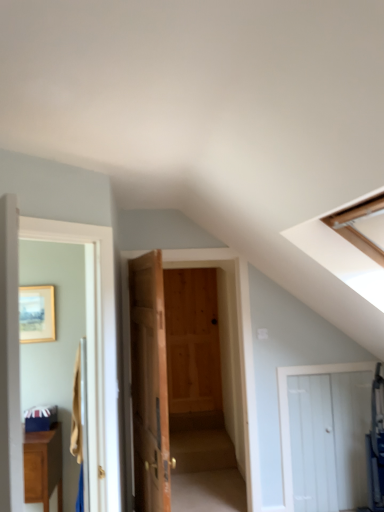
Question: Can you confirm if wooden door at center, acting as the second door starting from the left, is bigger than white wooden door at lower right, acting as the 1th door starting from the right?

Choices:
 (A) no
 (B) yes

Answer: (B)

Question: Considering the relative positions of wooden door at center, acting as the second door starting from the left, and white wooden door at lower right, the 4th door in the left-to-right sequence, in the image provided, is wooden door at center, acting as the second door starting from the left, to the left of white wooden door at lower right, the 4th door in the left-to-right sequence, from the viewer's perspective?

Choices:
 (A) yes
 (B) no

Answer: (A)

Question: Is wooden door at center, acting as the second door starting from the left, smaller than white wooden door at lower right, acting as the 1th door starting from the right?

Choices:
 (A) yes
 (B) no

Answer: (B)

Question: Does wooden door at center, which is the 3th door from right to left, lie in front of white wooden door at lower right, acting as the 1th door starting from the right?

Choices:
 (A) no
 (B) yes

Answer: (B)

Question: Is wooden door at center, acting as the second door starting from the left, shorter than white wooden door at lower right, acting as the 1th door starting from the right?

Choices:
 (A) no
 (B) yes

Answer: (A)

Question: Is wooden door at center, acting as the second door starting from the left, positioned behind white wooden door at lower right, acting as the 1th door starting from the right?

Choices:
 (A) no
 (B) yes

Answer: (A)

Question: From the image's perspective, is white wooden door at left, which appears as the 1th door when viewed from the left, over natural wood door at center, arranged as the 3th door when viewed from the left?

Choices:
 (A) no
 (B) yes

Answer: (B)

Question: From the image's perspective, is white wooden door at left, the 4th door positioned from the right, under natural wood door at center, which is the 2th door in right-to-left order?

Choices:
 (A) yes
 (B) no

Answer: (B)

Question: Does white wooden door at left, the 4th door positioned from the right, appear on the left side of natural wood door at center, which is the 2th door in right-to-left order?

Choices:
 (A) no
 (B) yes

Answer: (B)

Question: Is white wooden door at left, the 4th door positioned from the right, far away from natural wood door at center, arranged as the 3th door when viewed from the left?

Choices:
 (A) yes
 (B) no

Answer: (A)

Question: Can you confirm if white wooden door at left, the 4th door positioned from the right, is bigger than natural wood door at center, which is the 2th door in right-to-left order?

Choices:
 (A) no
 (B) yes

Answer: (A)

Question: Is white wooden door at left, the 4th door positioned from the right, positioned with its back to natural wood door at center, arranged as the 3th door when viewed from the left?

Choices:
 (A) yes
 (B) no

Answer: (B)

Question: Is matte brown cabinet at lower left looking in the opposite direction of white wooden door at lower right, acting as the 1th door starting from the right?

Choices:
 (A) yes
 (B) no

Answer: (B)